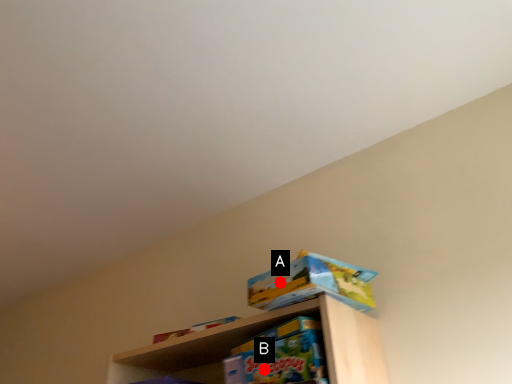
Question: Two points are circled on the image, labeled by A and B beside each circle. Which point appears closest to the camera in this image?

Choices:
 (A) A is closer
 (B) B is closer

Answer: (A)